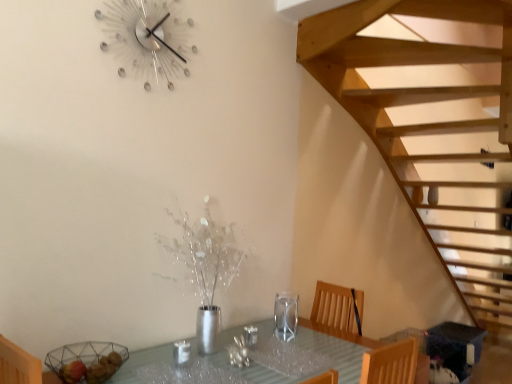
What do you see at coordinates (286, 316) in the screenshot? I see `transparent glass wine glass at center` at bounding box center [286, 316].

I want to click on metallic crystal wall clock at upper center, so click(147, 38).

Identify the location of transparent glass wine glass at center. (286, 316).

Is transparent glass wine glass at center thinner than metallic crystal wall clock at upper center?

In fact, transparent glass wine glass at center might be wider than metallic crystal wall clock at upper center.

Between transparent glass wine glass at center and metallic crystal wall clock at upper center, which one has more height?

metallic crystal wall clock at upper center is taller.

What's the angular difference between transparent glass wine glass at center and metallic crystal wall clock at upper center's facing directions?

0.358 degrees separate the facing orientations of transparent glass wine glass at center and metallic crystal wall clock at upper center.

Between metallic crystal wall clock at upper center and transparent glass wine glass at center, which one has less height?

transparent glass wine glass at center.

What's the angular difference between metallic crystal wall clock at upper center and transparent glass wine glass at center's facing directions?

metallic crystal wall clock at upper center and transparent glass wine glass at center are facing 0.358 degrees away from each other.

From a real-world perspective, who is located lower, metallic crystal wall clock at upper center or transparent glass wine glass at center?

transparent glass wine glass at center, from a real-world perspective.

How far apart are metallic crystal wall clock at upper center and transparent glass wine glass at center?

metallic crystal wall clock at upper center and transparent glass wine glass at center are 4.80 feet apart.

Is clear glass table at center not close to metallic crystal wall clock at upper center?

Indeed, clear glass table at center is not near metallic crystal wall clock at upper center.

Does clear glass table at center have a smaller size compared to metallic crystal wall clock at upper center?

No.

Is clear glass table at center to the left of metallic crystal wall clock at upper center from the viewer's perspective?

Incorrect, clear glass table at center is not on the left side of metallic crystal wall clock at upper center.

Which of these two, clear glass table at center or metallic crystal wall clock at upper center, stands taller?

Standing taller between the two is metallic crystal wall clock at upper center.

Is metallic crystal wall clock at upper center oriented away from clear glass table at center?

metallic crystal wall clock at upper center does not have its back to clear glass table at center.

Based on the photo, measure the distance between metallic crystal wall clock at upper center and clear glass table at center.

metallic crystal wall clock at upper center is 5.41 feet away from clear glass table at center.

From a real-world perspective, who is located higher, metallic crystal wall clock at upper center or clear glass table at center?

In real-world perspective, metallic crystal wall clock at upper center is above.

From the image's perspective, is metallic crystal wall clock at upper center on clear glass table at center?

Correct, metallic crystal wall clock at upper center appears higher than clear glass table at center in the image.

Which of these two, transparent glass wine glass at center or clear glass table at center, is thinner?

transparent glass wine glass at center.

From a real-world perspective, which object stands above the other?

transparent glass wine glass at center.

Is transparent glass wine glass at center oriented towards clear glass table at center?

No, transparent glass wine glass at center is not facing towards clear glass table at center.

Considering the relative sizes of clear glass table at center and transparent glass wine glass at center in the image provided, is clear glass table at center smaller than transparent glass wine glass at center?

Actually, clear glass table at center might be larger than transparent glass wine glass at center.

Image resolution: width=512 pixels, height=384 pixels. I want to click on table below the transparent glass wine glass at center (from a real-world perspective), so click(339, 334).

Can we say clear glass table at center lies outside transparent glass wine glass at center?

Indeed, clear glass table at center is completely outside transparent glass wine glass at center.

What are the coordinates of `wine glass below the metallic crystal wall clock at upper center (from a real-world perspective)` in the screenshot? It's located at (286, 316).

You are a GUI agent. You are given a task and a screenshot of the screen. Output one action in this format:
    pyautogui.click(x=<x>, y=<y>)
    Task: Click on the wall clock lying above the transparent glass wine glass at center (from the image's perspective)
    
    Given the screenshot: What is the action you would take?
    pyautogui.click(x=147, y=38)

Which object lies nearer to the anchor point metallic crystal wall clock at upper center, transparent glass wine glass at center or clear glass table at center?

transparent glass wine glass at center lies closer to metallic crystal wall clock at upper center than the other object.

Based on the photo, considering their positions, is transparent glass wine glass at center positioned further to clear glass table at center than metallic crystal wall clock at upper center?

Based on the image, metallic crystal wall clock at upper center appears to be further to clear glass table at center.

Based on their spatial positions, is metallic crystal wall clock at upper center or transparent glass wine glass at center further from clear glass table at center?

metallic crystal wall clock at upper center is positioned further to the anchor clear glass table at center.

Which object lies further to the anchor point transparent glass wine glass at center, metallic crystal wall clock at upper center or clear glass table at center?

metallic crystal wall clock at upper center.

Looking at the image, which one is located further to metallic crystal wall clock at upper center, clear glass table at center or transparent glass wine glass at center?

The object further to metallic crystal wall clock at upper center is clear glass table at center.

Estimate the real-world distances between objects in this image. Which object is further from transparent glass wine glass at center, clear glass table at center or metallic crystal wall clock at upper center?

Based on the image, metallic crystal wall clock at upper center appears to be further to transparent glass wine glass at center.

Find the location of a particular element. wine glass that lies between metallic crystal wall clock at upper center and clear glass table at center from top to bottom is located at coordinates (286, 316).